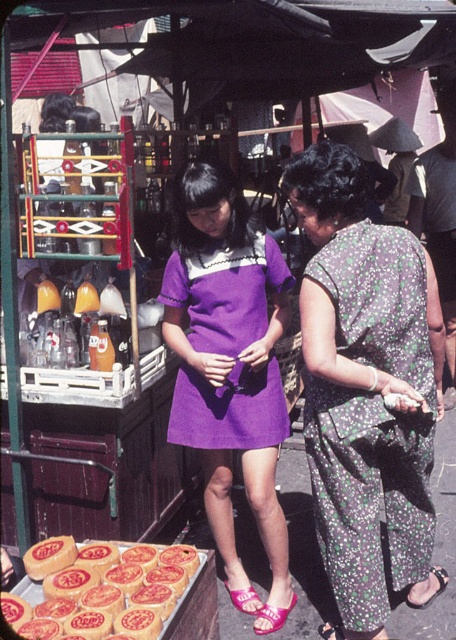
In the scene shown: You are a photographer trying to capture a photo of the golden brown pastry at lower left without the purple fabric dress at center blocking the view. Is this possible given their positions?

The purple fabric dress at center is further to the viewer than the golden brown pastry at lower left, so the dress would block the pastry from view unless moved or the photographer adjusts their angle.

You are standing at point (99,545) and want to walk to point (218,358). Is the destination point behind you or in front of you?

The destination point (218,358) is behind point (99,545), so it is behind you.

Based on the photo, you are a photographer standing in the bustling street scene. You want to take a clear photo of the golden brown pastry at lower left but the purple cotton dress at center is blocking the view. Can you move the dress to get a clear shot?

The purple cotton dress at center is positioned over the golden brown pastry at lower left, so moving the dress would allow you to capture the pastry without obstruction.